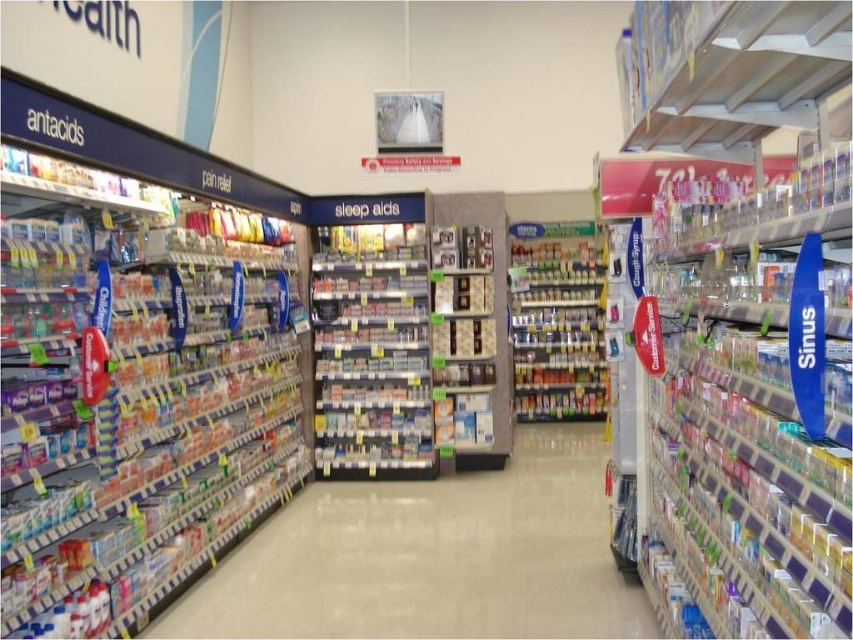
You are a store employee who needs to place a new display in the center aisle. The display requires a clear space of 2 meters in length. Can the white plastic shelves at center accommodate this display based on their position?

The white plastic shelves at center are positioned at coordinates point (431, 557). However, without knowing the length of the shelves themselves, it is impossible to determine if they can accommodate a 2 meter display. Additional measurements are needed.

You are a customer in the pharmacy aisle and need to locate the matte plastic antacids at left. According to the store layout, where should you look on the shelves?

The matte plastic antacids at left are located at point 0.616 on the x axis and 0.158 on the y axis.

You are a store employee who needs to restock the shelves. You have a new box of matte plastic antacids at left and a stack of white plastic shelves at center. Which item requires more storage space due to its size?

The matte plastic antacids at left requires more storage space because it has a larger size compared to the white plastic shelves at center.